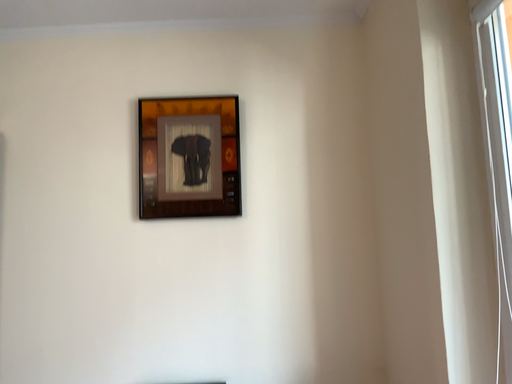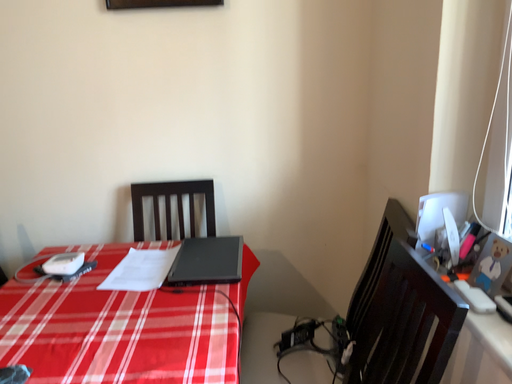
Question: Which way did the camera rotate in the video?

Choices:
 (A) rotated upward
 (B) rotated downward

Answer: (B)